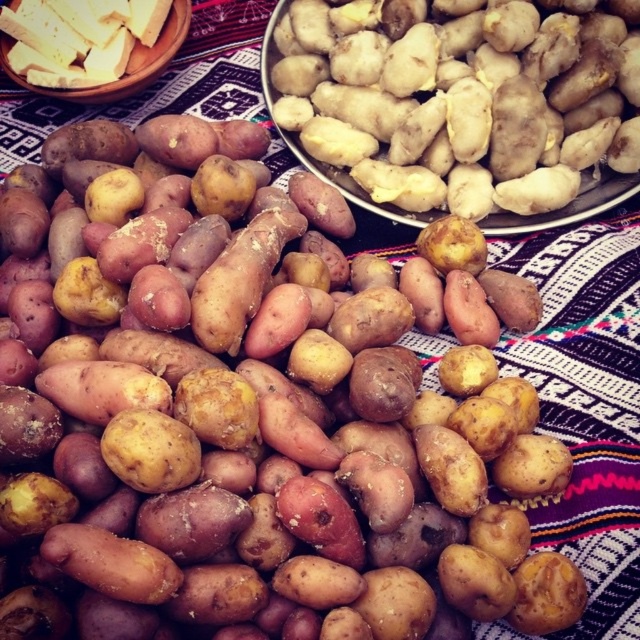
Between smooth beige potato at center and yellowish crumbly cheese at upper left, which one has less height?

yellowish crumbly cheese at upper left

How much distance is there between smooth beige potato at center and yellowish crumbly cheese at upper left?

They are 62.48 centimeters apart.

At what (x,y) coordinates should I click in order to perform the action: click on smooth beige potato at center. Please return your answer as a coordinate pair (x, y). Image resolution: width=640 pixels, height=640 pixels. Looking at the image, I should click on (451, 113).

The image size is (640, 640). I want to click on smooth beige potato at center, so click(451, 113).